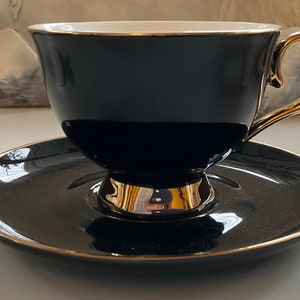
Locate an element on the screen. The image size is (300, 300). tea set is located at coordinates (168, 163).